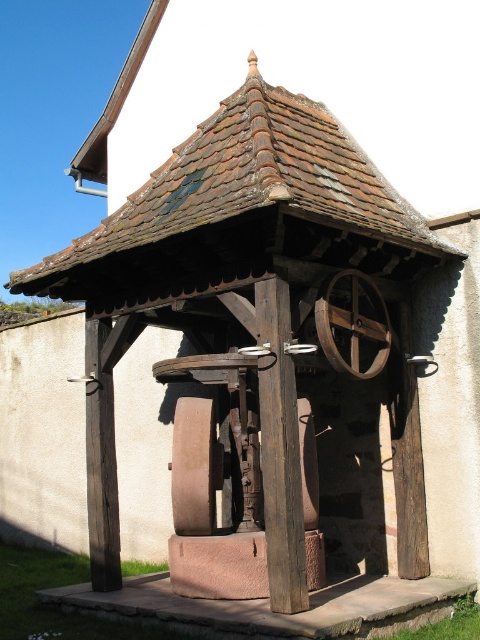
You are standing in front of an old wooden well with two points marked on its structure. The first point is at coordinate (331, 348) and the second at (213, 465). Which point is nearer to you?

Point (331, 348) is closer to the viewer than point (213, 465).